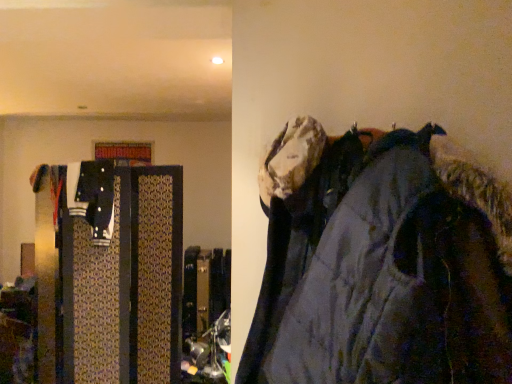
Based on the photo, measure the distance between point (134, 274) and camera.

The distance of point (134, 274) from camera is 8.86 feet.

The image size is (512, 384). Describe the element at coordinates (111, 278) in the screenshot. I see `patterned fabric suitcase at left` at that location.

Where is `patterned fabric suitcase at left`? Image resolution: width=512 pixels, height=384 pixels. patterned fabric suitcase at left is located at coordinates (111, 278).

This screenshot has height=384, width=512. Identify the location of dark gray fabric jacket at right. (379, 264).

The image size is (512, 384). What do you see at coordinates (379, 264) in the screenshot? I see `dark gray fabric jacket at right` at bounding box center [379, 264].

The height and width of the screenshot is (384, 512). What are the coordinates of `patterned fabric suitcase at left` in the screenshot? It's located at (111, 278).

Considering the relative positions of dark gray fabric jacket at right and patterned fabric suitcase at left in the image provided, is dark gray fabric jacket at right to the left of patterned fabric suitcase at left from the viewer's perspective?

Incorrect, dark gray fabric jacket at right is not on the left side of patterned fabric suitcase at left.

Considering their positions, is dark gray fabric jacket at right located in front of or behind patterned fabric suitcase at left?

Clearly, dark gray fabric jacket at right is in front of patterned fabric suitcase at left.

Which is closer to the camera, (419, 237) or (111, 293)?

Point (419, 237) is positioned closer to the camera compared to point (111, 293).

From the image's perspective, is dark gray fabric jacket at right above or below patterned fabric suitcase at left?

dark gray fabric jacket at right is above patterned fabric suitcase at left.

From a real-world perspective, is dark gray fabric jacket at right positioned over patterned fabric suitcase at left based on gravity?

Yes, from a real-world perspective, dark gray fabric jacket at right is on top of patterned fabric suitcase at left.

Which of these two, dark gray fabric jacket at right or patterned fabric suitcase at left, is thinner?

patterned fabric suitcase at left.

Between dark gray fabric jacket at right and patterned fabric suitcase at left, which one has less height?

Standing shorter between the two is dark gray fabric jacket at right.

Can you confirm if dark gray fabric jacket at right is bigger than patterned fabric suitcase at left?

Incorrect, dark gray fabric jacket at right is not larger than patterned fabric suitcase at left.

Do you think dark gray fabric jacket at right is within patterned fabric suitcase at left, or outside of it?

dark gray fabric jacket at right is not inside patterned fabric suitcase at left, it's outside.

Is dark gray fabric jacket at right far away from patterned fabric suitcase at left?

Yes.

Is dark gray fabric jacket at right oriented away from patterned fabric suitcase at left?

No, dark gray fabric jacket at right's orientation is not away from patterned fabric suitcase at left.

Image resolution: width=512 pixels, height=384 pixels. In the image, there is a dark gray fabric jacket at right. In order to click on closet below it (from the image's perspective) in this screenshot , I will do `click(111, 278)`.

Looking at this image, can you confirm if patterned fabric suitcase at left is positioned to the left of dark gray fabric jacket at right?

Yes.

Does patterned fabric suitcase at left come in front of dark gray fabric jacket at right?

No, it is not.

Which is closer, (42, 256) or (468, 176)?

The point (468, 176) is in front.

From the image's perspective, is patterned fabric suitcase at left on top of dark gray fabric jacket at right?

No, from the image's perspective, patterned fabric suitcase at left is not above dark gray fabric jacket at right.

From a real-world perspective, between patterned fabric suitcase at left and dark gray fabric jacket at right, who is vertically lower?

From a 3D spatial view, patterned fabric suitcase at left is below.

Which object is thinner, patterned fabric suitcase at left or dark gray fabric jacket at right?

patterned fabric suitcase at left is thinner.

Who is shorter, patterned fabric suitcase at left or dark gray fabric jacket at right?

dark gray fabric jacket at right is shorter.

Which of these two, patterned fabric suitcase at left or dark gray fabric jacket at right, is bigger?

patterned fabric suitcase at left.

Is patterned fabric suitcase at left spatially inside dark gray fabric jacket at right, or outside of it?

The correct answer is: outside.

Is patterned fabric suitcase at left placed right next to dark gray fabric jacket at right?

There is a gap between patterned fabric suitcase at left and dark gray fabric jacket at right.

Is patterned fabric suitcase at left positioned with its back to dark gray fabric jacket at right?

No.

How different are the orientations of patterned fabric suitcase at left and dark gray fabric jacket at right in degrees?

patterned fabric suitcase at left and dark gray fabric jacket at right are facing 12.6 degrees away from each other.

How much distance is there between patterned fabric suitcase at left and dark gray fabric jacket at right?

1.77 meters.

Where is `closet below the dark gray fabric jacket at right (from the image's perspective)`? The width and height of the screenshot is (512, 384). closet below the dark gray fabric jacket at right (from the image's perspective) is located at coordinates (111, 278).

This screenshot has height=384, width=512. What are the coordinates of `closet that is behind the dark gray fabric jacket at right` in the screenshot? It's located at (111, 278).

You are a GUI agent. You are given a task and a screenshot of the screen. Output one action in this format:
    pyautogui.click(x=<x>, y=<y>)
    Task: Click on the closet on the left of the dark gray fabric jacket at right
    Image resolution: width=512 pixels, height=384 pixels.
    Given the screenshot: What is the action you would take?
    pyautogui.click(x=111, y=278)